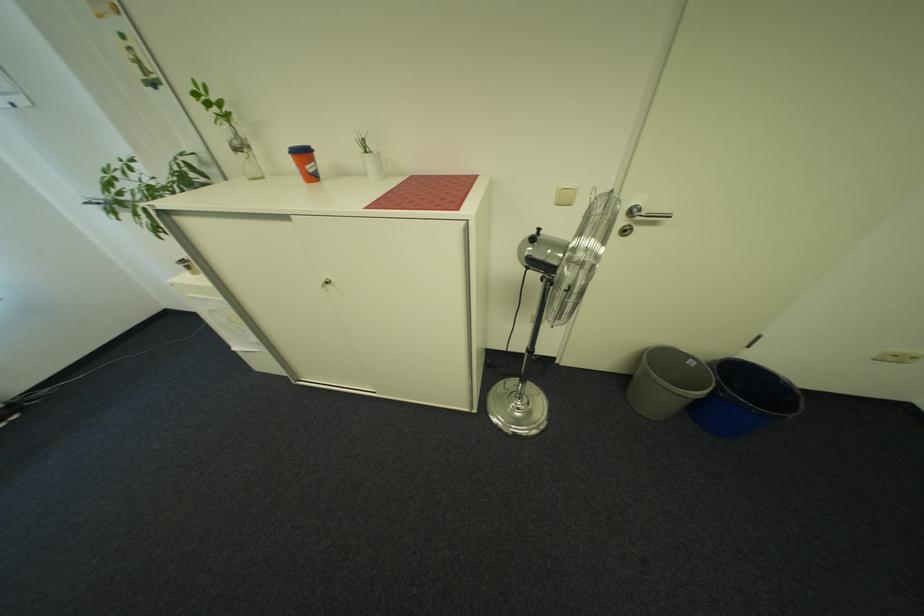
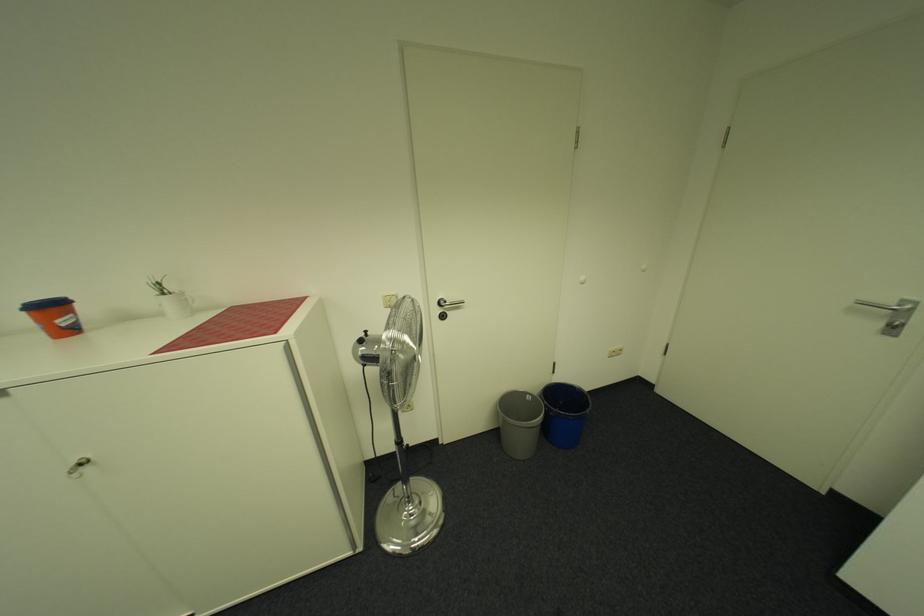
Locate, in the second image, the point that corresponds to (x=334, y=281) in the first image.

(83, 464)